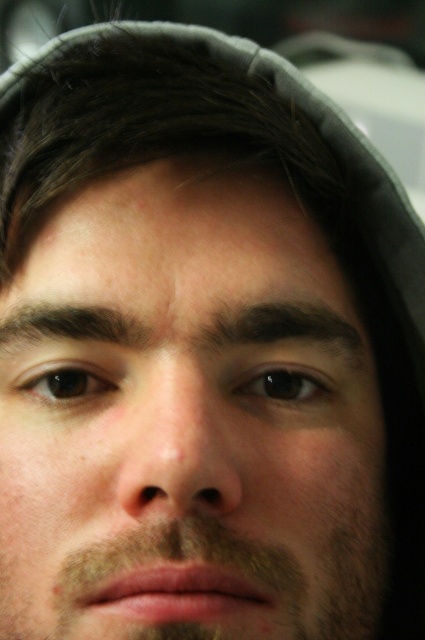
You are a photographer adjusting the lighting for a portrait. You need to ensure that both the smooth skin face at center and the brown fuzzy beard at lower center are evenly illuminated. Based on their positions, which direction should you move the light source to achieve this?

The smooth skin face at center is to the left of the brown fuzzy beard at lower center. To evenly illuminate both, move the light source to the right side so that it can adequately light both areas simultaneously.

Based on the scene description, which object is larger in size between the smooth skin face at center and the brown fuzzy beard at lower center?

The smooth skin face at center is bigger than the brown fuzzy beard at lower center according to the description.

From the picture: You are a photographer adjusting your camera settings. The subject has a smooth skin face at center. To ensure the face is in focus, where should you position the focus point on the camera screen?

The smooth skin face at center is located at point (187, 419), so you should position the focus point at those coordinates to ensure the face is in focus.